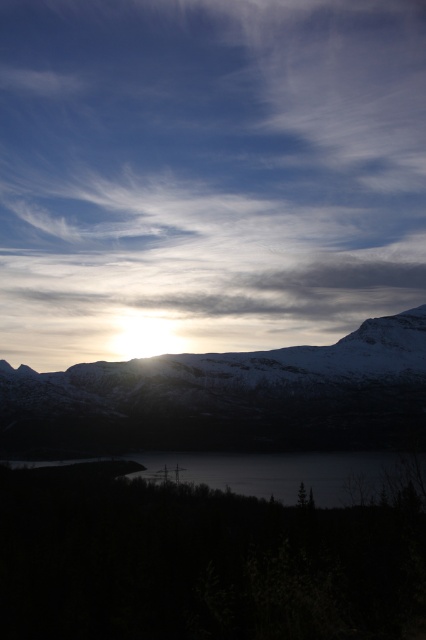
Is snowy rock mountain range at center below dark glassy water at center?

Incorrect, snowy rock mountain range at center is not positioned below dark glassy water at center.

The width and height of the screenshot is (426, 640). I want to click on snowy rock mountain range at center, so click(x=227, y=397).

Locate an element on the screen. snowy rock mountain range at center is located at coordinates (227, 397).

Does point (337, 284) come behind point (226, 458)?

Yes, it is.

Which is behind, point (302, 317) or point (379, 497)?

Point (302, 317)

Where is `white fluffy cloud at upper center`? The image size is (426, 640). white fluffy cloud at upper center is located at coordinates (207, 173).

Where is `white fluffy cloud at upper center`? white fluffy cloud at upper center is located at coordinates pyautogui.click(x=207, y=173).

Is white fluffy cloud at upper center to the left of snowy rock mountain range at center from the viewer's perspective?

Indeed, white fluffy cloud at upper center is positioned on the left side of snowy rock mountain range at center.

Is point (264, 289) farther from viewer compared to point (394, 426)?

Yes, point (264, 289) is farther from viewer.

Identify the location of white fluffy cloud at upper center. The height and width of the screenshot is (640, 426). (207, 173).